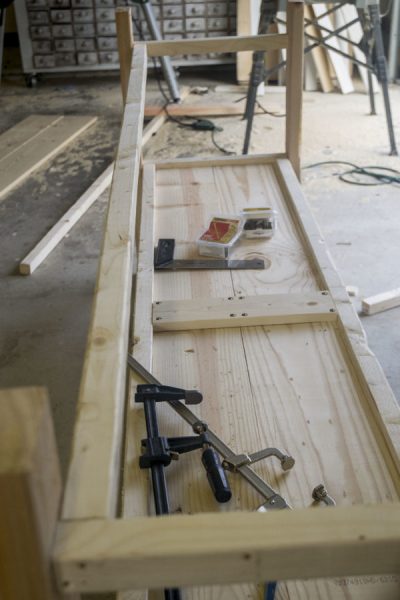
I want to click on piece of wood on the floor, so click(55, 142), click(36, 128), click(75, 213), click(375, 302).